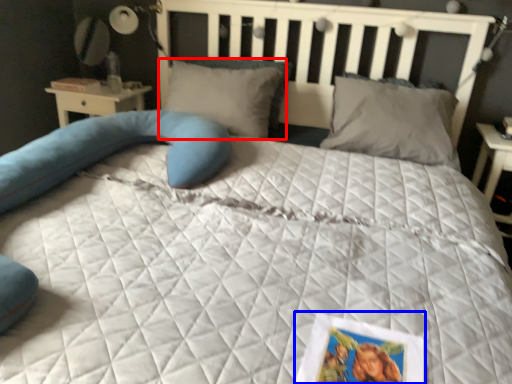
Question: Which object is closer to the camera taking this photo, pillow (highlighted by a red box) or postcard (highlighted by a blue box)?

Choices:
 (A) pillow
 (B) postcard

Answer: (B)